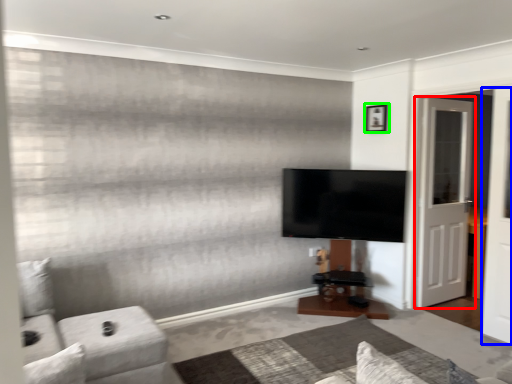
Question: Considering the real-world distances, which object is farthest from door (highlighted by a red box)? screen door (highlighted by a blue box) or picture frame (highlighted by a green box)?

Choices:
 (A) screen door
 (B) picture frame

Answer: (B)